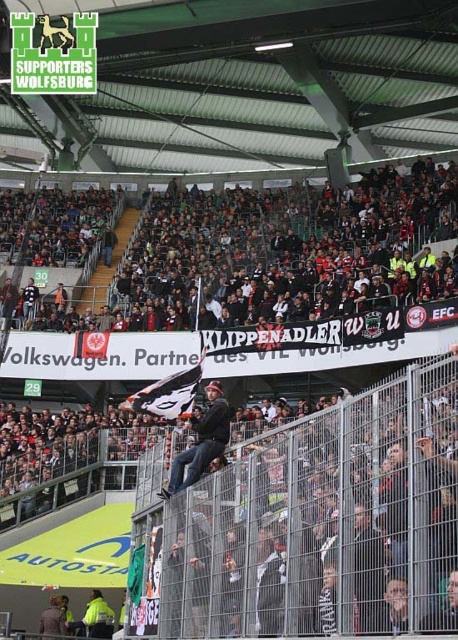
Question: Among these objects, which one is farthest from the camera?

Choices:
 (A) metallic silver fence at center
 (B) dark gray fabric crowd at center
 (C) dark gray denim jacket at center

Answer: (B)

Question: Can you confirm if dark gray fabric crowd at center is positioned below dark gray denim jacket at center?

Choices:
 (A) no
 (B) yes

Answer: (A)

Question: Based on their relative distances, which object is nearer to the dark gray denim jacket at center?

Choices:
 (A) metallic silver fence at center
 (B) dark gray fabric crowd at center

Answer: (A)

Question: Which of the following is the closest to the observer?

Choices:
 (A) metallic silver fence at center
 (B) dark gray fabric crowd at center

Answer: (A)

Question: Observing the image, what is the correct spatial positioning of dark gray fabric crowd at center in reference to dark gray denim jacket at center?

Choices:
 (A) above
 (B) below

Answer: (A)

Question: Is metallic silver fence at center behind dark gray fabric crowd at center?

Choices:
 (A) no
 (B) yes

Answer: (A)